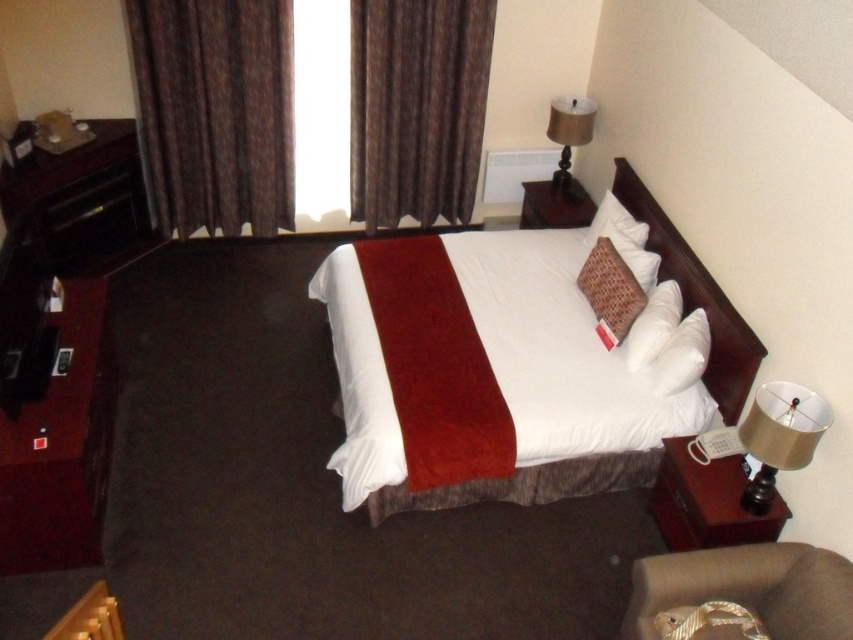
Looking at this image, you are a guest in the hotel room and want to find the red card. You see the brown textured pillow at center and the white soft pillow at upper center. Which pillow is closer to the red card?

The brown textured pillow at center is closer to the red card because it is below the white soft pillow at upper center, so the red card is likely placed near the lower pillow.

You are a hotel guest who wants to place a small book between the dark wood headboard at upper right and the brown textured pillow at center. Can you fit it there?

The dark wood headboard at upper right is thinner than the brown textured pillow at center, so there might be enough space to place the small book between them.

You are a hotel guest who wants to place a small book between the brown textured pillow at center and the white soft pillow at upper center. Which pillow should you place the book closer to if you want the book to be near the wider pillow?

The brown textured pillow at center is wider than the white soft pillow at upper center, so you should place the book closer to the brown textured pillow at center.